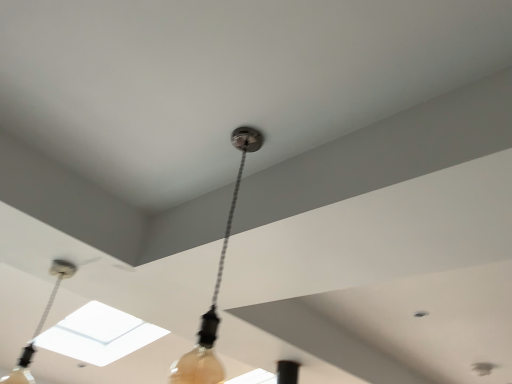
Question: Is matte black lamp at center, which ranks as the first lamp in front-to-back order, far away from matte black cord at upper center, the second lamp positioned from the right?

Choices:
 (A) no
 (B) yes

Answer: (B)

Question: Does matte black lamp at center, positioned as the 2th lamp in left-to-right order, have a lesser width compared to matte black cord at upper center, the second lamp positioned from the right?

Choices:
 (A) no
 (B) yes

Answer: (A)

Question: Can you confirm if matte black lamp at center, positioned as the 2th lamp in left-to-right order, is positioned to the right of matte black cord at upper center, the first lamp from the left?

Choices:
 (A) yes
 (B) no

Answer: (A)

Question: Does matte black lamp at center, positioned as the 2th lamp in left-to-right order, lie in front of matte black cord at upper center, the second lamp positioned from the right?

Choices:
 (A) no
 (B) yes

Answer: (B)

Question: Is the position of matte black lamp at center, acting as the second lamp starting from the back, more distant than that of matte black cord at upper center, the first lamp from the left?

Choices:
 (A) yes
 (B) no

Answer: (B)

Question: Would you say matte black lamp at center, which ranks as the first lamp in front-to-back order, is outside matte black cord at upper center, the second lamp positioned from the right?

Choices:
 (A) yes
 (B) no

Answer: (A)

Question: From a real-world perspective, does matte black cord at upper center, the first lamp from the left, stand above matte black lamp at center, which ranks as the first lamp in front-to-back order?

Choices:
 (A) yes
 (B) no

Answer: (B)

Question: Is matte black cord at upper center, the second lamp positioned from the right, taller than matte black lamp at center, the first lamp in the right-to-left sequence?

Choices:
 (A) yes
 (B) no

Answer: (B)

Question: From the image's perspective, is matte black cord at upper center, the second lamp positioned from the right, located beneath matte black lamp at center, the first lamp in the right-to-left sequence?

Choices:
 (A) no
 (B) yes

Answer: (B)

Question: Would you consider matte black cord at upper center, which appears as the first lamp when viewed from the back, to be distant from matte black lamp at center, positioned as the 2th lamp in left-to-right order?

Choices:
 (A) yes
 (B) no

Answer: (A)

Question: From the image's perspective, is matte black cord at upper center, the second lamp positioned from the right, on top of matte black lamp at center, acting as the second lamp starting from the back?

Choices:
 (A) yes
 (B) no

Answer: (B)

Question: Is matte black cord at upper center, the first lamp from the left, thinner than matte black lamp at center, which ranks as the first lamp in front-to-back order?

Choices:
 (A) no
 (B) yes

Answer: (B)

Question: Considering the positions of point (192, 369) and point (59, 281), is point (192, 369) closer or farther from the camera than point (59, 281)?

Choices:
 (A) closer
 (B) farther

Answer: (A)